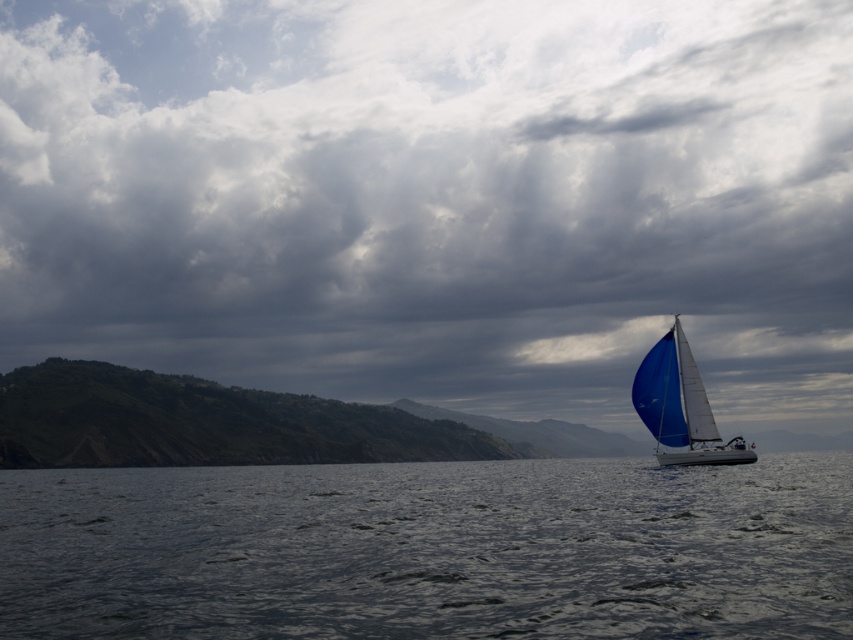
Question: Which object is closer to the camera taking this photo?

Choices:
 (A) dark blue water at lower center
 (B) cloudy sky at upper center

Answer: (A)

Question: Does dark blue water at lower center come in front of blue sailboat at right?

Choices:
 (A) yes
 (B) no

Answer: (A)

Question: Which of the following is the closest to the observer?

Choices:
 (A) dark blue water at lower center
 (B) blue sailboat at right
 (C) cloudy sky at upper center

Answer: (A)

Question: Is cloudy sky at upper center positioned behind blue sailboat at right?

Choices:
 (A) no
 (B) yes

Answer: (B)

Question: Is cloudy sky at upper center to the right of blue sailboat at right from the viewer's perspective?

Choices:
 (A) yes
 (B) no

Answer: (B)

Question: Which point is closer to the camera?

Choices:
 (A) (817, 269)
 (B) (666, 385)
 (C) (195, 634)

Answer: (C)